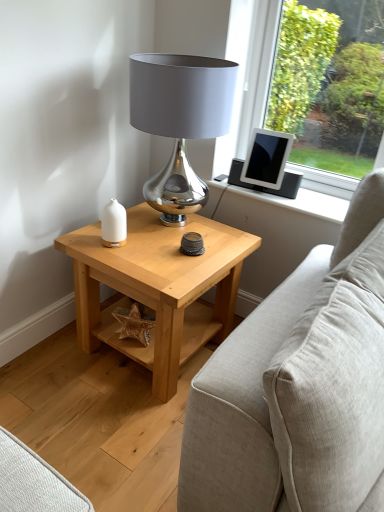
Locate an element on the screen. free point in front of light wood/texture side table at center is located at coordinates (106, 431).